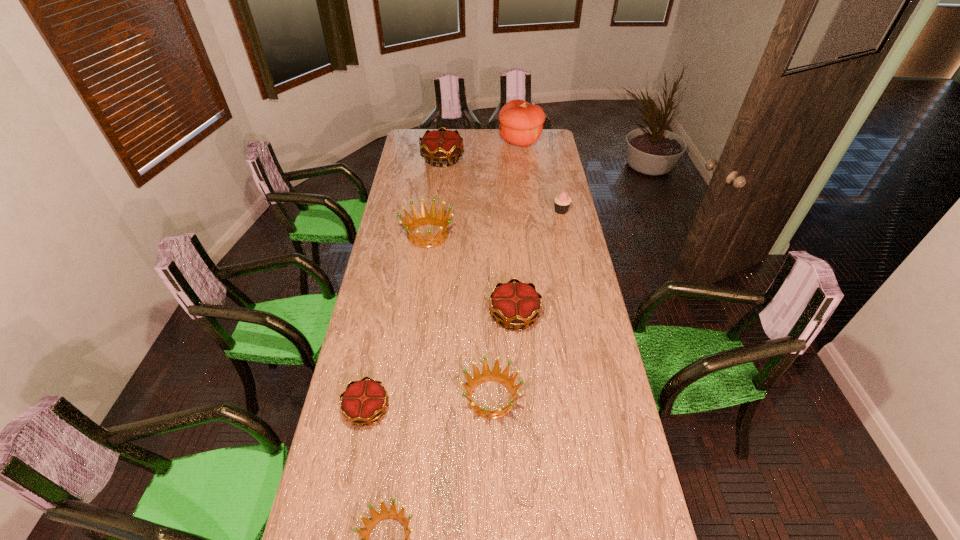
Locate an element on the screen. Image resolution: width=960 pixels, height=540 pixels. pumpkin is located at coordinates (521, 123).

Locate an element on the screen. This screenshot has width=960, height=540. the farthest gold crown is located at coordinates (441, 145).

Find the location of a particular element. The height and width of the screenshot is (540, 960). the farthest crown is located at coordinates (441, 145).

Locate an element on the screen. The image size is (960, 540). the fourth farthest object is located at coordinates (424, 218).

Locate an element on the screen. Image resolution: width=960 pixels, height=540 pixels. the biggest golden crown is located at coordinates (x=424, y=218).

Identify the location of the third farthest object. Image resolution: width=960 pixels, height=540 pixels. (x=562, y=202).

Identify the location of pink cupcake. The width and height of the screenshot is (960, 540). (562, 202).

Where is `the fourth nearest object`? The height and width of the screenshot is (540, 960). the fourth nearest object is located at coordinates (517, 304).

You are a GUI agent. You are given a task and a screenshot of the screen. Output one action in this format:
    pyautogui.click(x=<x>, y=<y>)
    Task: Click on the second nearest gold crown
    The width and height of the screenshot is (960, 540).
    Given the screenshot: What is the action you would take?
    pyautogui.click(x=517, y=304)

In order to click on the second farthest golden crown in this screenshot , I will do `click(503, 378)`.